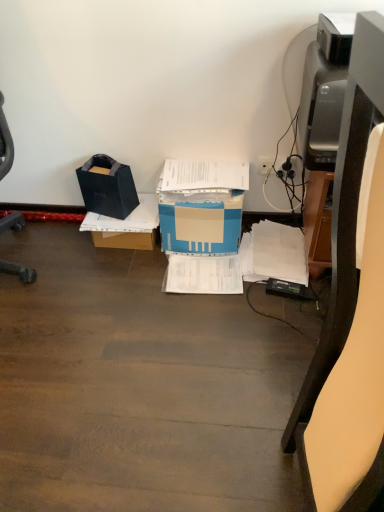
Question: Would you say matte black printer at right is a long distance from white plastic plug at upper right?

Choices:
 (A) yes
 (B) no

Answer: (A)

Question: Can you confirm if matte black printer at right is bigger than white plastic plug at upper right?

Choices:
 (A) no
 (B) yes

Answer: (B)

Question: Can you confirm if matte black printer at right is positioned to the left of white plastic plug at upper right?

Choices:
 (A) yes
 (B) no

Answer: (B)

Question: Is the depth of matte black printer at right less than that of white plastic plug at upper right?

Choices:
 (A) yes
 (B) no

Answer: (A)

Question: From a real-world perspective, is matte black printer at right over white plastic plug at upper right?

Choices:
 (A) no
 (B) yes

Answer: (B)

Question: Do you think brown cardboard box at center is within white plastic plug at upper right, or outside of it?

Choices:
 (A) inside
 (B) outside

Answer: (B)

Question: Is brown cardboard box at center to the left or to the right of white plastic plug at upper right in the image?

Choices:
 (A) right
 (B) left

Answer: (B)

Question: In terms of width, does brown cardboard box at center look wider or thinner when compared to white plastic plug at upper right?

Choices:
 (A) wide
 (B) thin

Answer: (A)

Question: Considering the positions of point (110, 244) and point (258, 163), is point (110, 244) closer or farther from the camera than point (258, 163)?

Choices:
 (A) closer
 (B) farther

Answer: (B)

Question: Considering the positions of black matte bag at left, marked as the 2th box in a right-to-left arrangement, and blue cardboard box at center, the 1th box in the right-to-left sequence, in the image, is black matte bag at left, marked as the 2th box in a right-to-left arrangement, wider or thinner than blue cardboard box at center, the 1th box in the right-to-left sequence,?

Choices:
 (A) wide
 (B) thin

Answer: (B)

Question: From the image's perspective, is black matte bag at left, which is counted as the first box, starting from the left, positioned above or below blue cardboard box at center, the 1th box in the right-to-left sequence?

Choices:
 (A) above
 (B) below

Answer: (A)

Question: From their relative heights in the image, would you say black matte bag at left, which is counted as the first box, starting from the left, is taller or shorter than blue cardboard box at center, placed as the second box when sorted from left to right?

Choices:
 (A) tall
 (B) short

Answer: (B)

Question: Do you think black matte bag at left, which is counted as the first box, starting from the left, is within blue cardboard box at center, the 1th box in the right-to-left sequence, or outside of it?

Choices:
 (A) outside
 (B) inside

Answer: (A)

Question: From the image's perspective, is blue cardboard box at center, the 1th box in the right-to-left sequence, above or below matte black printer at right?

Choices:
 (A) above
 (B) below

Answer: (A)

Question: Is point pos(183,201) positioned closer to the camera than point pos(332,504)?

Choices:
 (A) farther
 (B) closer

Answer: (A)